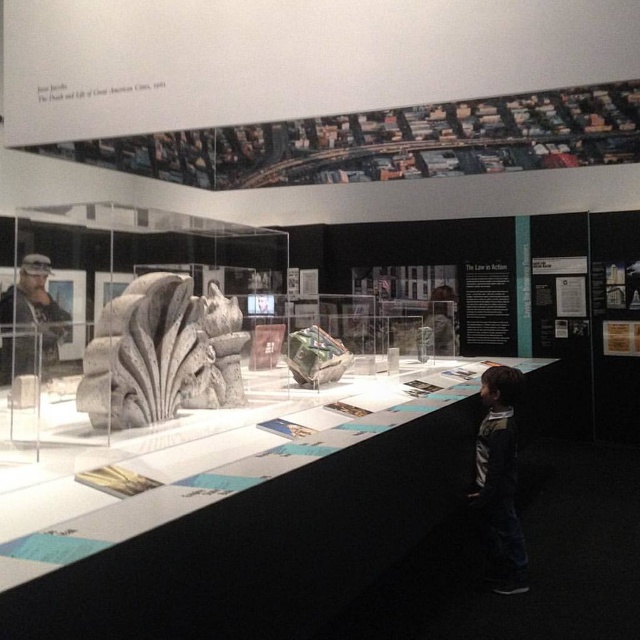
Question: Considering the real-world distances, which object is farthest from the gray stone sculpture at center?

Choices:
 (A) dark blue jeans at lower right
 (B) camouflage fabric uniform at left

Answer: (A)

Question: Is gray stone sculpture at center to the right of dark blue jeans at lower right from the viewer's perspective?

Choices:
 (A) no
 (B) yes

Answer: (A)

Question: In this image, where is gray stone sculpture at center located relative to camouflage fabric uniform at left?

Choices:
 (A) right
 (B) left

Answer: (A)

Question: Which object is farther from the camera taking this photo?

Choices:
 (A) dark blue jeans at lower right
 (B) camouflage fabric uniform at left

Answer: (A)

Question: Estimate the real-world distances between objects in this image. Which object is farther from the camouflage fabric uniform at left?

Choices:
 (A) gray stone sculpture at center
 (B) dark blue jeans at lower right

Answer: (B)

Question: Can you confirm if gray stone sculpture at center is thinner than dark blue jeans at lower right?

Choices:
 (A) yes
 (B) no

Answer: (B)